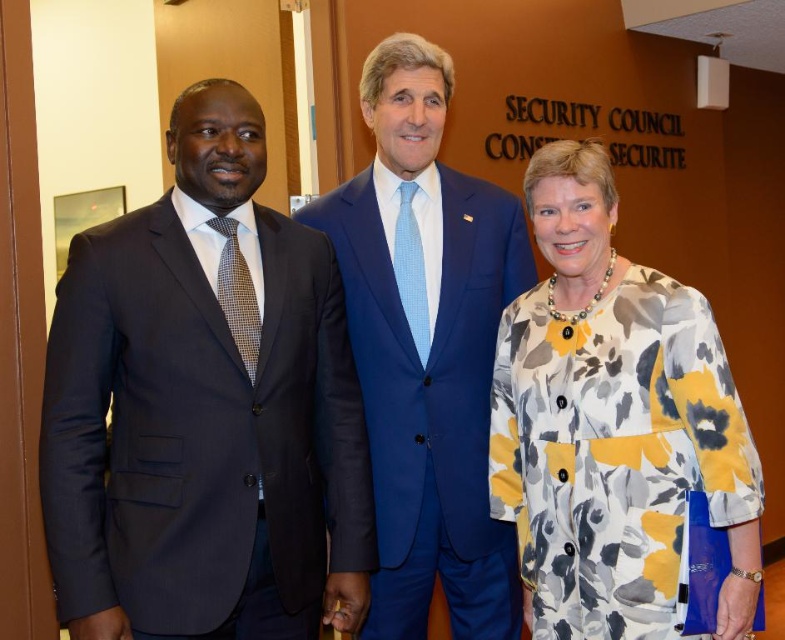
Can you confirm if matte black suit at left is positioned to the right of blue suit at center?

Incorrect, matte black suit at left is not on the right side of blue suit at center.

Which is more to the left, matte black suit at left or blue suit at center?

matte black suit at left is more to the left.

Does point (108, 504) come behind point (471, 458)?

No.

Where is `matte black suit at left`? The width and height of the screenshot is (785, 640). matte black suit at left is located at coordinates (203, 408).

In the scene shown: Which of these two, floral-patterned dress at center or blue suit at center, stands taller?

Standing taller between the two is blue suit at center.

Does floral-patterned dress at center have a lesser height compared to blue suit at center?

Yes, floral-patterned dress at center is shorter than blue suit at center.

The width and height of the screenshot is (785, 640). What are the coordinates of `floral-patterned dress at center` in the screenshot? It's located at (612, 426).

Based on the photo, does matte black suit at left appear on the left side of floral-patterned dress at center?

Yes, matte black suit at left is to the left of floral-patterned dress at center.

Find the location of a particular element. This screenshot has height=640, width=785. matte black suit at left is located at coordinates (203, 408).

Who is more forward, (302, 401) or (535, 440)?

Point (302, 401) is more forward.

I want to click on matte black suit at left, so click(x=203, y=408).